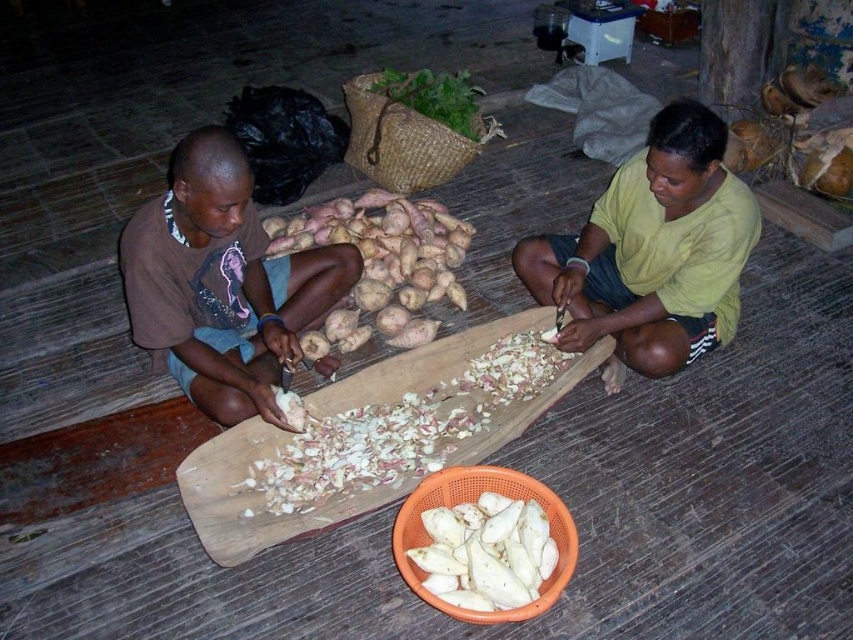
You are standing in the kitchen and see the brown cotton shirt at left and the white matte potato at center. Which object is higher in position?

The brown cotton shirt at left is above the white matte potato at center, so the brown cotton shirt at left is higher.

Consider the image. You are a chef preparing ingredients for a recipe. You need to know which of the items, the white matte potato at center or the white matte tubers at center, is positioned higher on the floor. Can you tell me which one is higher?

The white matte potato at center is located above white matte tubers at center, so the white matte potato at center is higher.

You are a chef preparing ingredients for a recipe. You have a white matte potato at center and white matte tubers at center on the floor. Your recipe requires you to place them in a pot that can only hold items within a 10 inch diameter. Can both items fit in the pot without moving them closer together?

The white matte potato at center and white matte tubers at center are 13.89 inches apart from each other. Since the pot can only hold items within a 10 inch diameter, they cannot fit in the pot without moving them closer together.